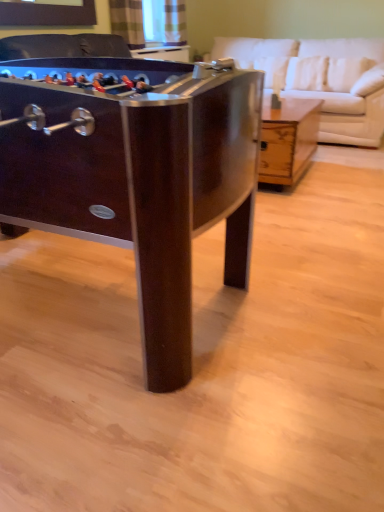
Identify the location of vacant area that lies to the right of wooden coffee table at center, the 2th table viewed from the left. This screenshot has height=512, width=384. (343, 172).